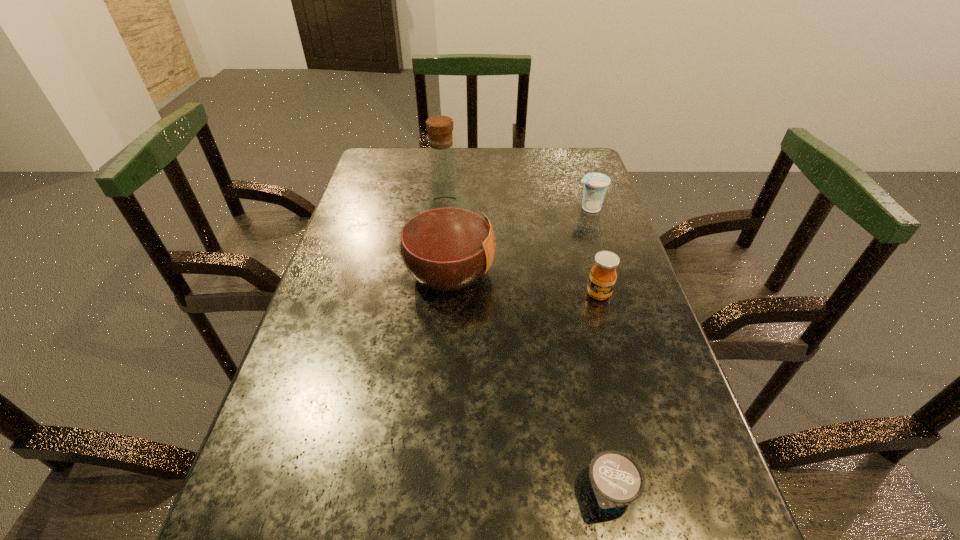
At what (x,y) coordinates should I click in order to perform the action: click on the tallest object. Please return your answer as a coordinate pair (x, y). Looking at the image, I should click on (446, 244).

The width and height of the screenshot is (960, 540). Identify the location of liquor. (446, 244).

This screenshot has height=540, width=960. I want to click on honey, so click(x=602, y=278).

In order to click on the right yogurt in this screenshot , I will do `click(595, 184)`.

Locate an element on the screen. the third tallest object is located at coordinates (595, 184).

At what (x,y) coordinates should I click in order to perform the action: click on the shortest object. Please return your answer as a coordinate pair (x, y). Looking at the image, I should click on (616, 480).

Find the location of a particular element. This screenshot has height=540, width=960. the nearest object is located at coordinates (616, 480).

Locate an element on the screen. The width and height of the screenshot is (960, 540). free space located 0.070m on the front label of the leftmost object is located at coordinates (524, 272).

At what (x,y) coordinates should I click in order to perform the action: click on vacant position located on the front-facing side of the honey. Please return your answer as a coordinate pair (x, y). This screenshot has height=540, width=960. Looking at the image, I should click on (637, 433).

At what (x,y) coordinates should I click in order to perform the action: click on free region located 0.230m on the back of the farther yogurt. Please return your answer as a coordinate pair (x, y). The width and height of the screenshot is (960, 540). Looking at the image, I should click on (575, 162).